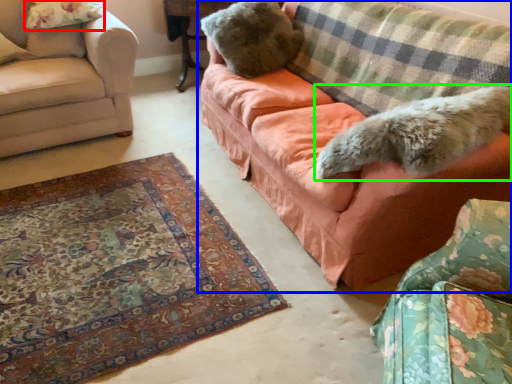
Question: Based on their relative distances, which object is farther from pillow (highlighted by a red box)? Choose from studio couch (highlighted by a blue box) and animal (highlighted by a green box).

Choices:
 (A) studio couch
 (B) animal

Answer: (B)